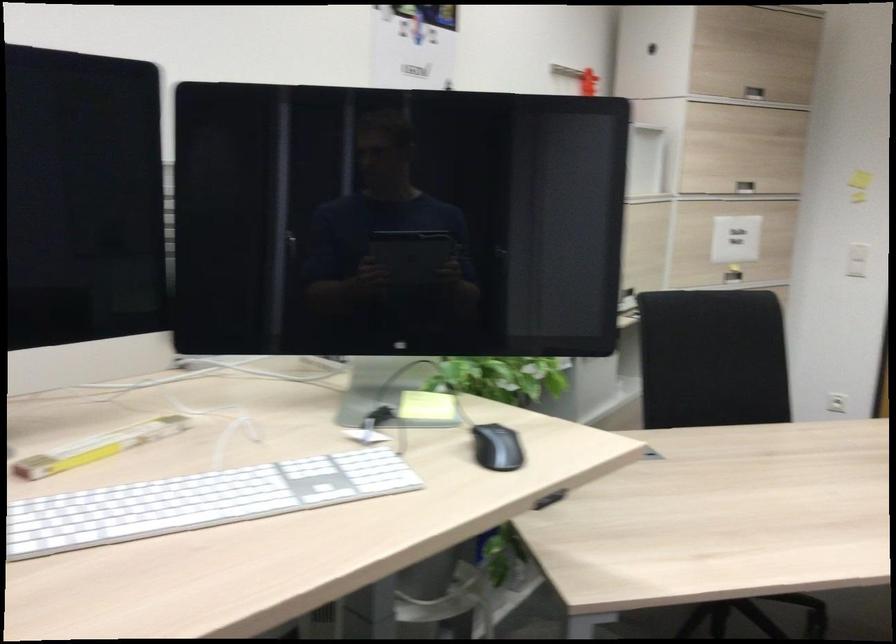
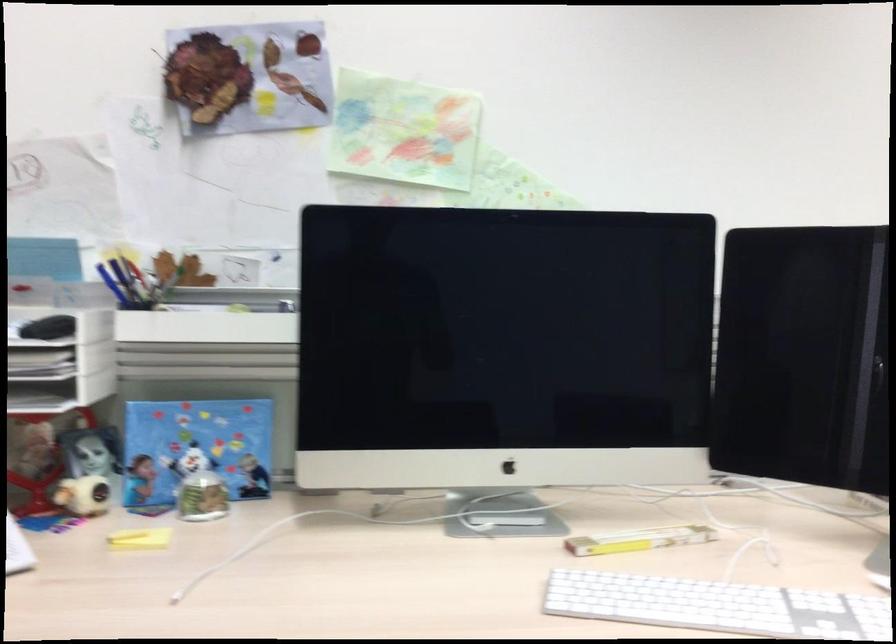
In the second image, find the point that corresponds to point 104,449 in the first image.

(638, 540)